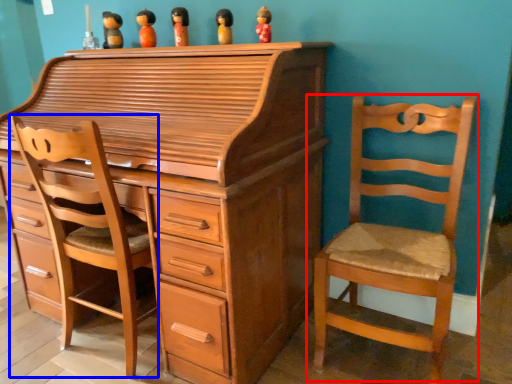
Question: Which object is closer to the camera taking this photo, chair (highlighted by a red box) or swivel chair (highlighted by a blue box)?

Choices:
 (A) chair
 (B) swivel chair

Answer: (A)